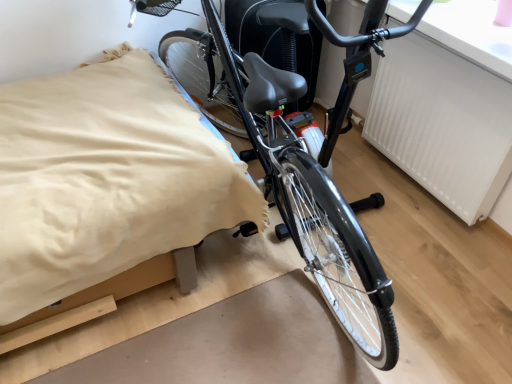
The height and width of the screenshot is (384, 512). I want to click on vacant location below white textured radiator at upper right (from a real-world perspective), so click(x=413, y=185).